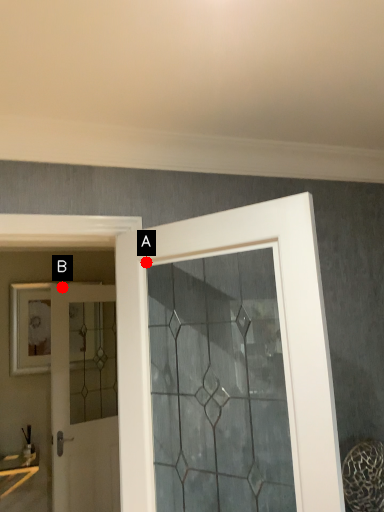
Question: Two points are circled on the image, labeled by A and B beside each circle. Which point appears closest to the camera in this image?

Choices:
 (A) A is closer
 (B) B is closer

Answer: (A)